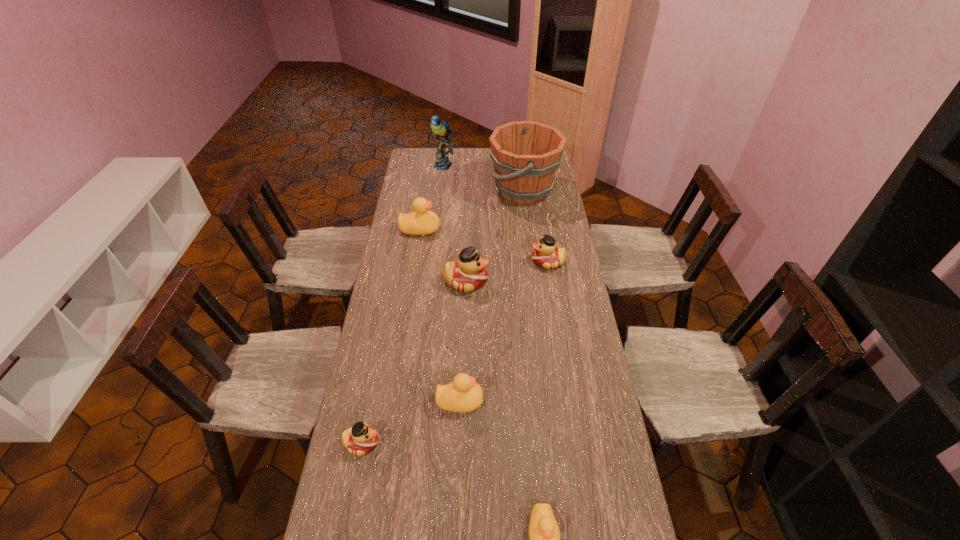
In the image, there is a desktop. Where is `vacant area at the right edge`? vacant area at the right edge is located at coordinates (539, 206).

Where is `free area in between the smallest red duck and the rightmost duck`? The height and width of the screenshot is (540, 960). free area in between the smallest red duck and the rightmost duck is located at coordinates (455, 353).

Locate an element on the screen. free space between the bucket and the second red duck from left to right is located at coordinates (494, 237).

The height and width of the screenshot is (540, 960). Find the location of `vacant area that lies between the bucket and the biggest red duck`. vacant area that lies between the bucket and the biggest red duck is located at coordinates (494, 237).

Locate an element on the screen. This screenshot has width=960, height=540. vacant point located between the second nearest yellow duck and the biggest red duck is located at coordinates (463, 341).

Find the location of a particular element. unoccupied area between the parrot and the biggest red duck is located at coordinates (454, 224).

Where is `free space between the biggest red duck and the smallest red duck`? This screenshot has height=540, width=960. free space between the biggest red duck and the smallest red duck is located at coordinates (414, 362).

The image size is (960, 540). Identify the location of empty space that is in between the bucket and the nearest red duck. (x=443, y=317).

At what (x,y) coordinates should I click in order to perform the action: click on object that can be found as the third closest to the bucket. Please return your answer as a coordinate pair (x, y). This screenshot has width=960, height=540. Looking at the image, I should click on [x=546, y=255].

I want to click on the fifth closest object to the second nearest object, so click(420, 222).